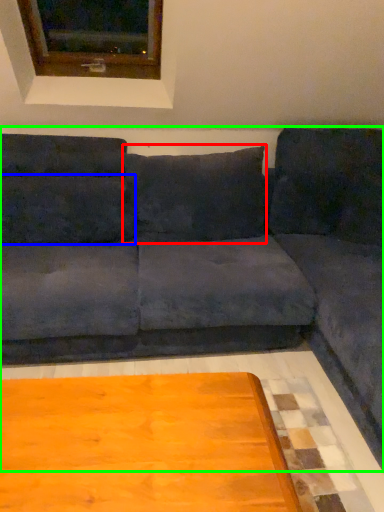
Question: Estimate the real-world distances between objects in this image. Which object is closer to pillow (highlighted by a red box), pillow (highlighted by a blue box) or studio couch (highlighted by a green box)?

Choices:
 (A) pillow
 (B) studio couch

Answer: (B)